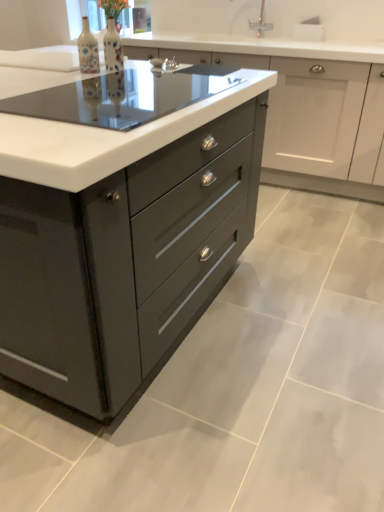
Question: From the image's perspective, is glossy dark gray chest of drawers at center located above or below matte gray cabinet at center?

Choices:
 (A) above
 (B) below

Answer: (B)

Question: Do you think glossy dark gray chest of drawers at center is within matte gray cabinet at center, or outside of it?

Choices:
 (A) outside
 (B) inside

Answer: (A)

Question: Estimate the real-world distances between objects in this image. Which object is closer to the matte ceramic bottle at upper left, the first bottle viewed from the left?

Choices:
 (A) matte black cooktop at center
 (B) glossy dark gray chest of drawers at center
 (C) matte ceramic vase at upper center, the 1th bottle when ordered from right to left
 (D) matte gray cabinet at center

Answer: (C)

Question: Based on their relative distances, which object is farther from the matte gray cabinet at center?

Choices:
 (A) matte ceramic vase at upper center, the 1th bottle when ordered from right to left
 (B) matte ceramic bottle at upper left, the first bottle viewed from the left
 (C) matte black cooktop at center
 (D) glossy dark gray chest of drawers at center

Answer: (D)